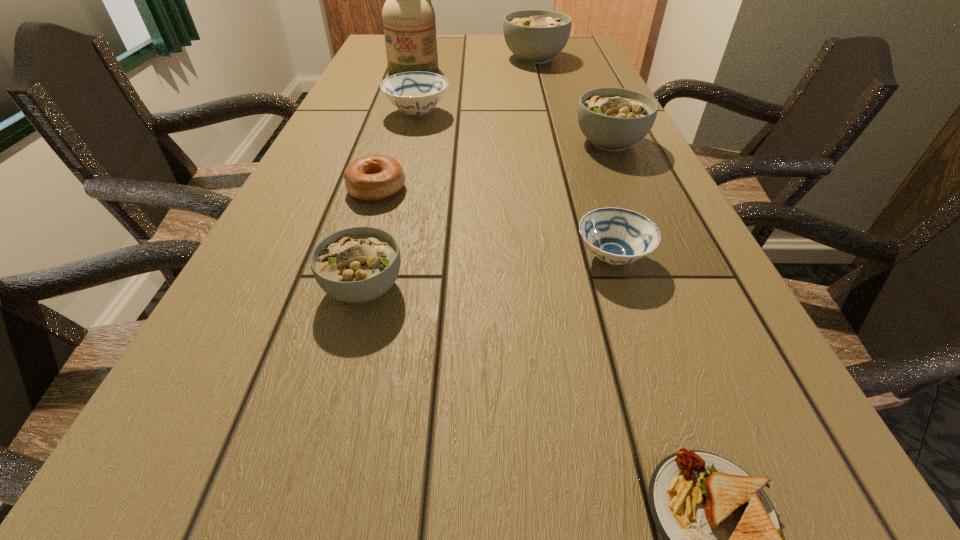
This screenshot has width=960, height=540. Find the location of `cleansing agent located at the left edge`. cleansing agent located at the left edge is located at coordinates (409, 23).

Where is `bagel that is positioned at the left edge`? The height and width of the screenshot is (540, 960). bagel that is positioned at the left edge is located at coordinates (373, 177).

Locate an element on the screen. This screenshot has width=960, height=540. object at the far right corner is located at coordinates 535,36.

The image size is (960, 540). I want to click on vacant space at the far edge, so click(x=502, y=45).

The height and width of the screenshot is (540, 960). What are the coordinates of `free spot at the left edge of the desktop` in the screenshot? It's located at (355, 77).

This screenshot has height=540, width=960. Find the location of `vacant space at the right edge of the desktop`. vacant space at the right edge of the desktop is located at coordinates (556, 72).

In the image, there is a desktop. Where is `free space at the near left corner`? free space at the near left corner is located at coordinates (144, 533).

Locate an element on the screen. free space at the far right corner is located at coordinates (575, 35).

At what (x,y) coordinates should I click in order to perform the action: click on free space between the bigger blue soup bowl and the leftmost white soup bowl. Please return your answer as a coordinate pair (x, y). Looking at the image, I should click on (391, 200).

Identify the location of free spot between the biggest white soup bowl and the farther blue soup bowl. point(476,86).